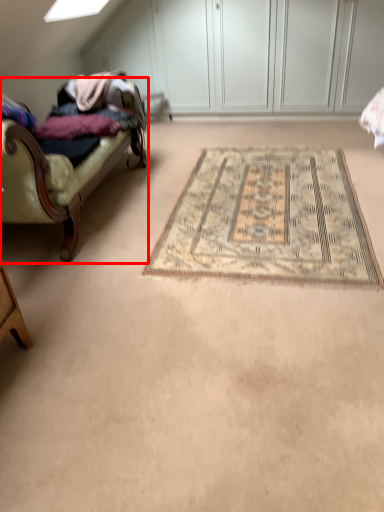
Question: From the image's perspective, what is the correct spatial relationship of studio couch (annotated by the red box) in relation to mat?

Choices:
 (A) below
 (B) above

Answer: (B)